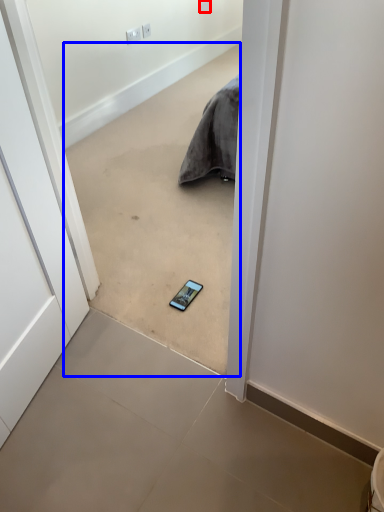
Question: Which object appears closest to the camera in this image, electric outlet (highlighted by a red box) or concrete (highlighted by a blue box)?

Choices:
 (A) electric outlet
 (B) concrete

Answer: (B)